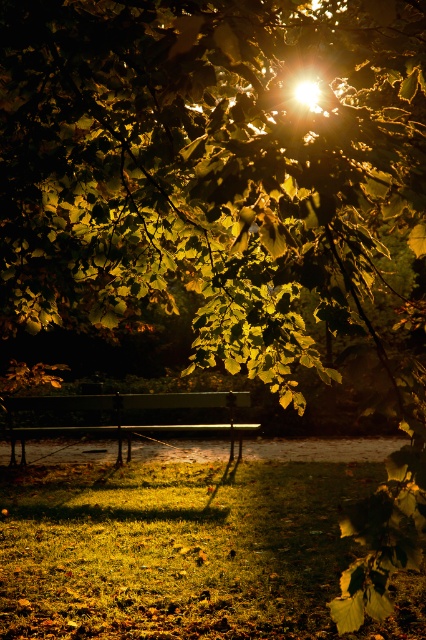
You are a maintenance worker who needs to reach the matte glass light at upper center from the green matte bench at center. Given that your ladder is 8 meters long, will you be able to reach the light?

The distance between the green matte bench at center and the matte glass light at upper center is 8.78 meters, which is longer than the ladder length of 8 meters. Therefore, you will not be able to reach the matte glass light at upper center with the ladder.

You are standing at the center of the park and want to sit on the green matte bench at center. According to the coordinates, is the bench located to your left or right side?

The green matte bench at center is located at coordinates point 0.639 on the x axis, which is to the right of the center point 0.5. Therefore, the bench is to your right side.